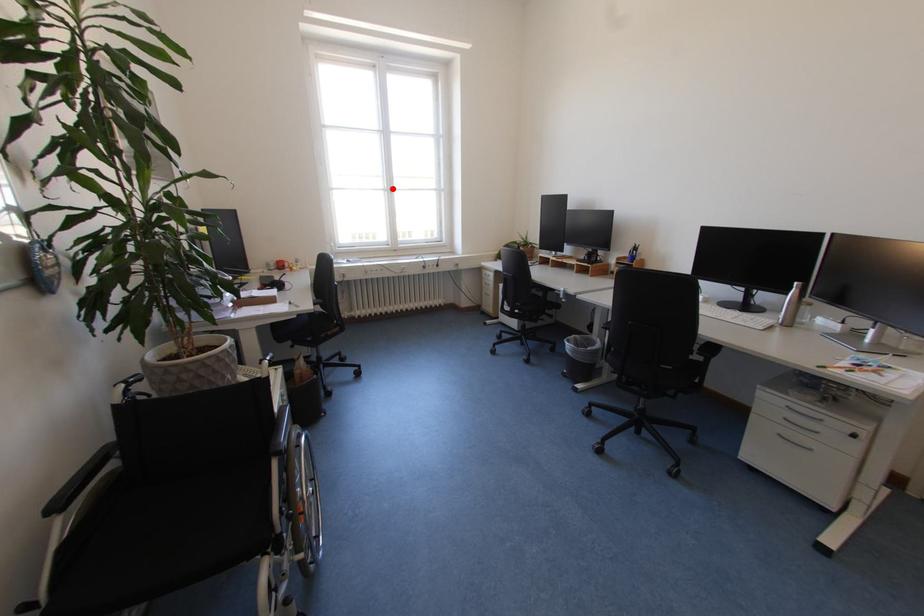
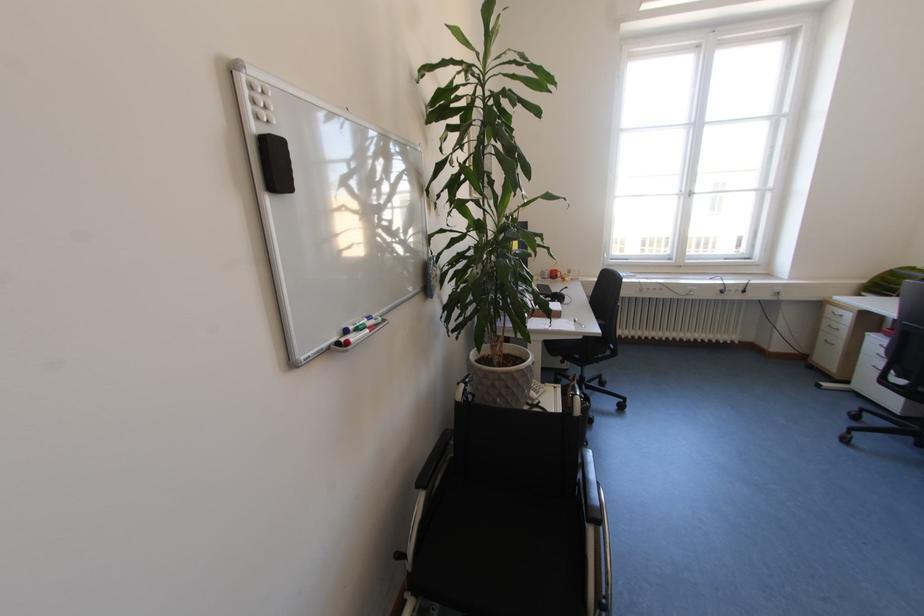
In the second image, find the point that corresponds to the highlighted location in the first image.

(688, 192)